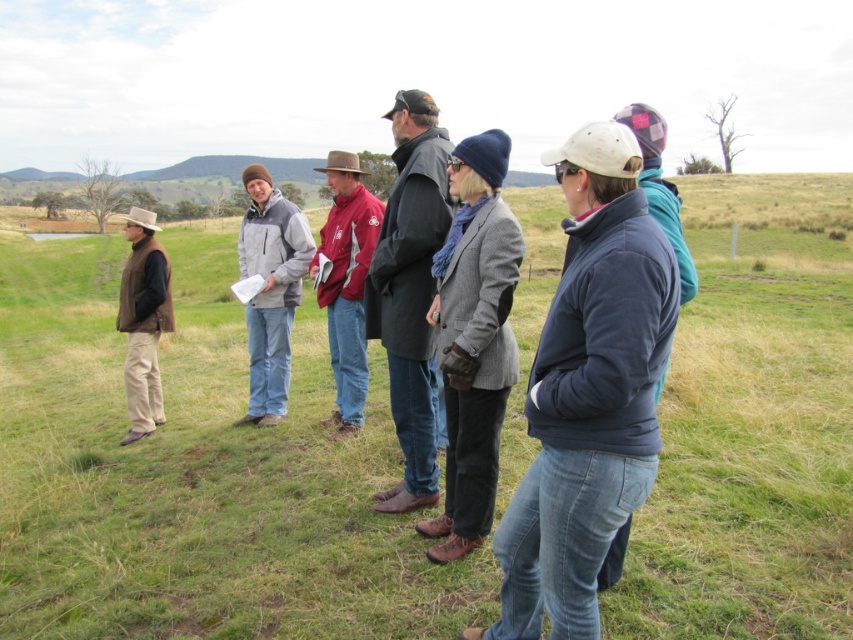
Can you confirm if gray matte jacket at center is positioned above matte red jacket at center?

No, gray matte jacket at center is not above matte red jacket at center.

Between gray matte jacket at center and matte red jacket at center, which one is positioned higher?

Positioned higher is matte red jacket at center.

Which is behind, point (258, 173) or point (355, 260)?

The point (258, 173) is more distant.

This screenshot has height=640, width=853. I want to click on gray matte jacket at center, so click(x=270, y=291).

Based on the photo, is gray woolen blazer at center smaller than matte red jacket at center?

Correct, gray woolen blazer at center occupies less space than matte red jacket at center.

This screenshot has height=640, width=853. Describe the element at coordinates (474, 339) in the screenshot. I see `gray woolen blazer at center` at that location.

Identify the location of gray woolen blazer at center. Image resolution: width=853 pixels, height=640 pixels. (474, 339).

Is dark gray coat at center shorter than matte brown vest at left?

No, dark gray coat at center is not shorter than matte brown vest at left.

Who is more distant from viewer, (410, 266) or (140, 364)?

The point (140, 364) is behind.

Measure the distance between point (434, 196) and camera.

They are 3.94 meters apart.

The width and height of the screenshot is (853, 640). Identify the location of dark gray coat at center. pos(410,291).